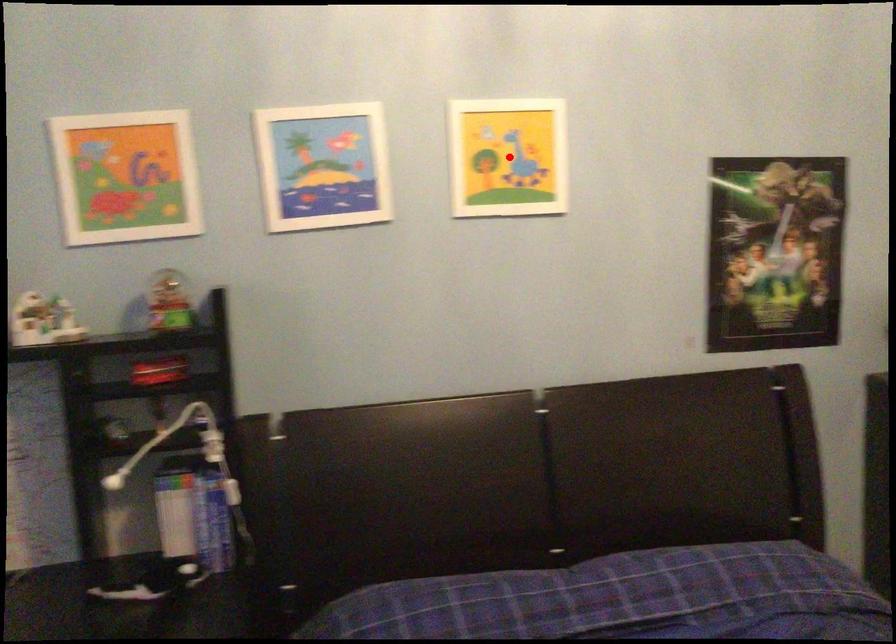
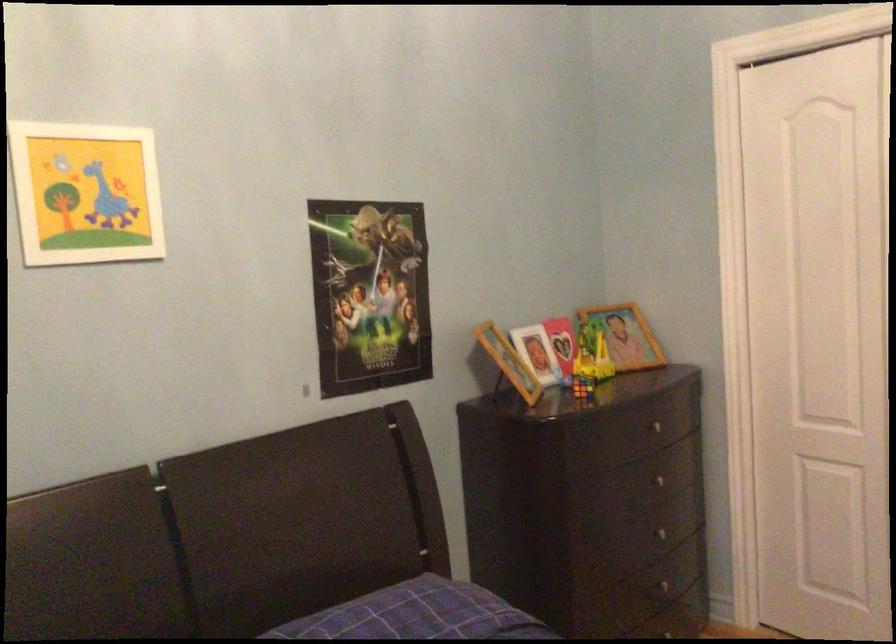
In the second image, find the point that corresponds to the highlighted location in the first image.

(85, 193)